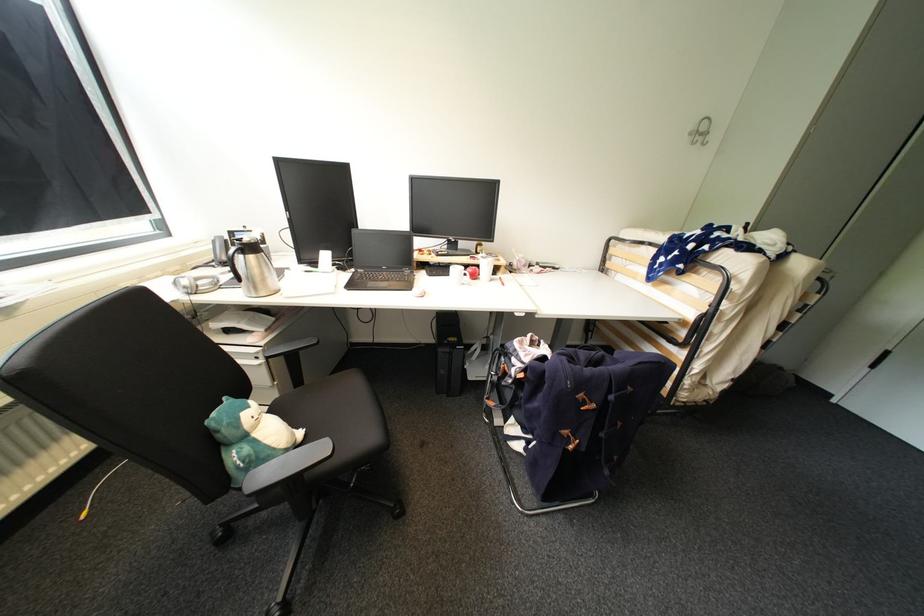
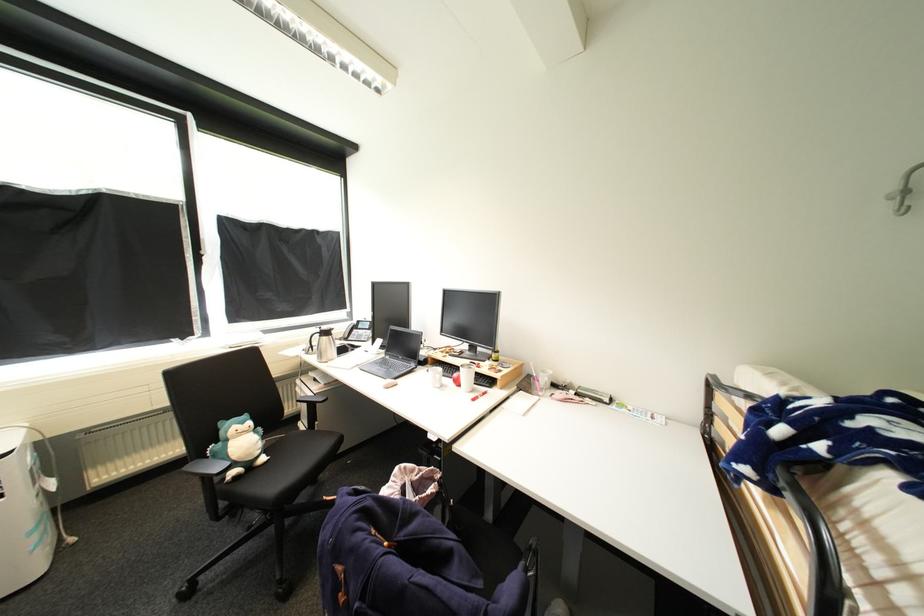
The point at (477, 270) is marked in the first image. Where is the corresponding point in the second image?

(462, 376)